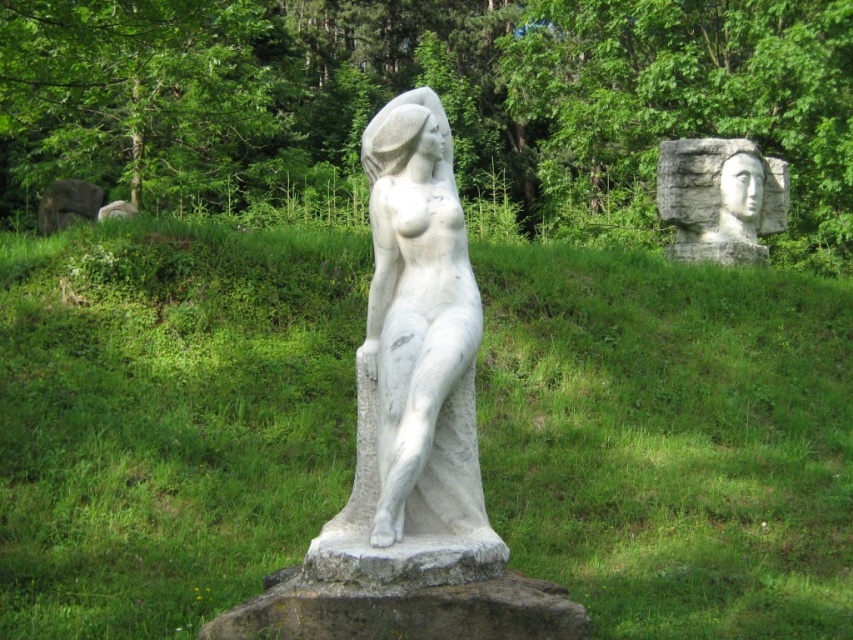
You are standing on a grassy hillside and see the green grass at center and the white marble statue at center. Which object is closer to you?

The green grass at center is closer to you because it is further to the viewer than the white marble statue at center.

You are standing at the center of the grassy hillside and want to take a photo of the white marble statue at center. Where should you position yourself relative to the statue to ensure it is centered in your camera frame?

To center the white marble statue at center in your camera frame, position yourself directly in front of it at the calculated coordinates point (413, 372), ensuring the statue is aligned with the frame.